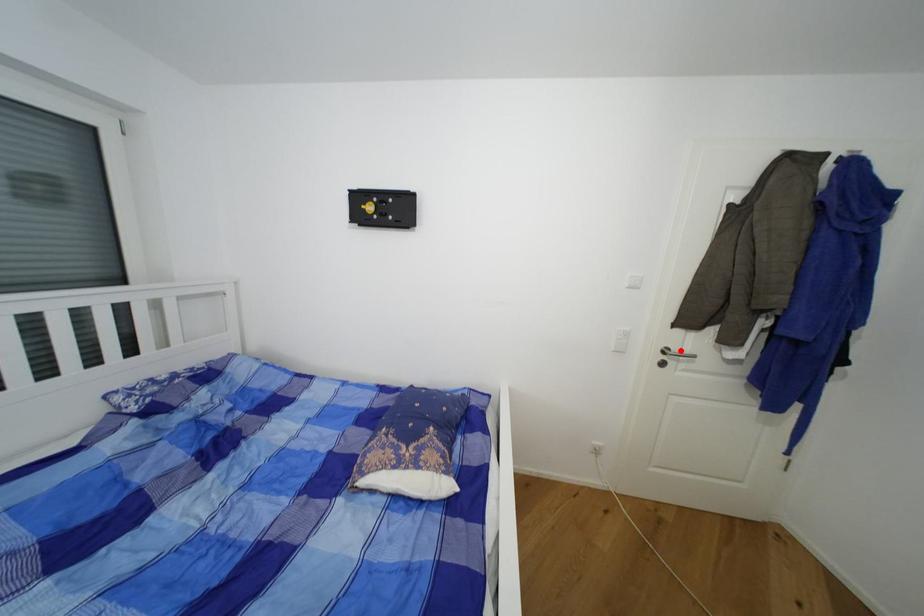
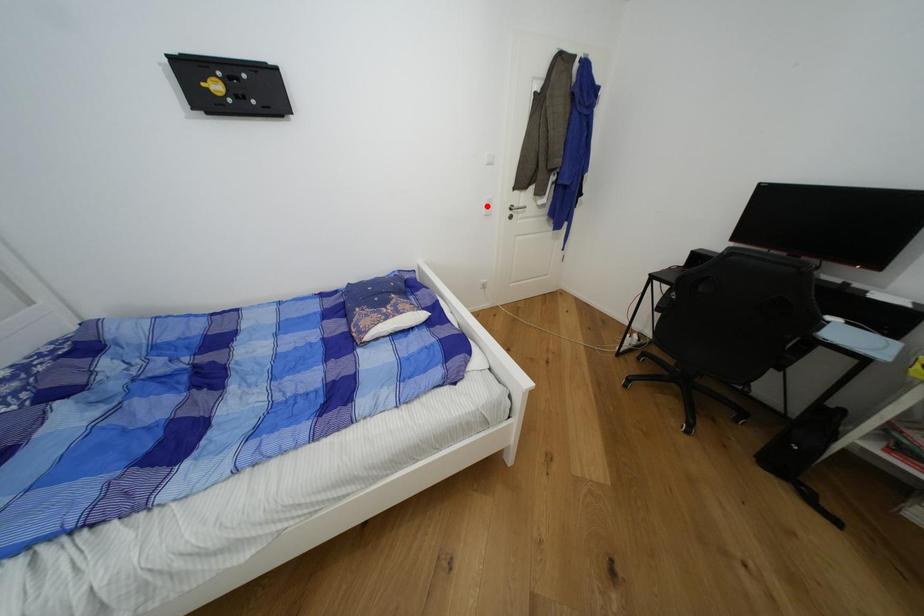
I am providing you with two images of the same scene from different viewpoints. A red point is marked on the first image and another point is marked on the second image. Do the highlighted points in image1 and image2 indicate the same real-world spot?

No